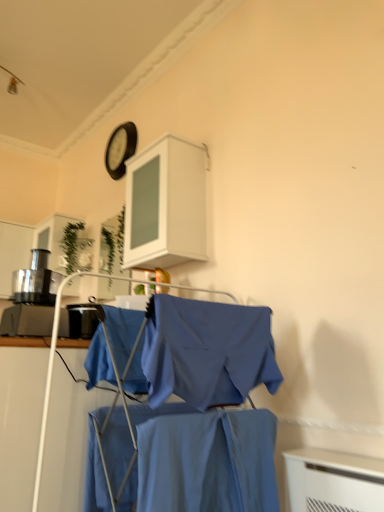
Where is `empty space that is ontop of smooth cotton shirt at center, which is counted as the 2th fabric, starting from the back`? This screenshot has height=512, width=384. empty space that is ontop of smooth cotton shirt at center, which is counted as the 2th fabric, starting from the back is located at coordinates (200, 407).